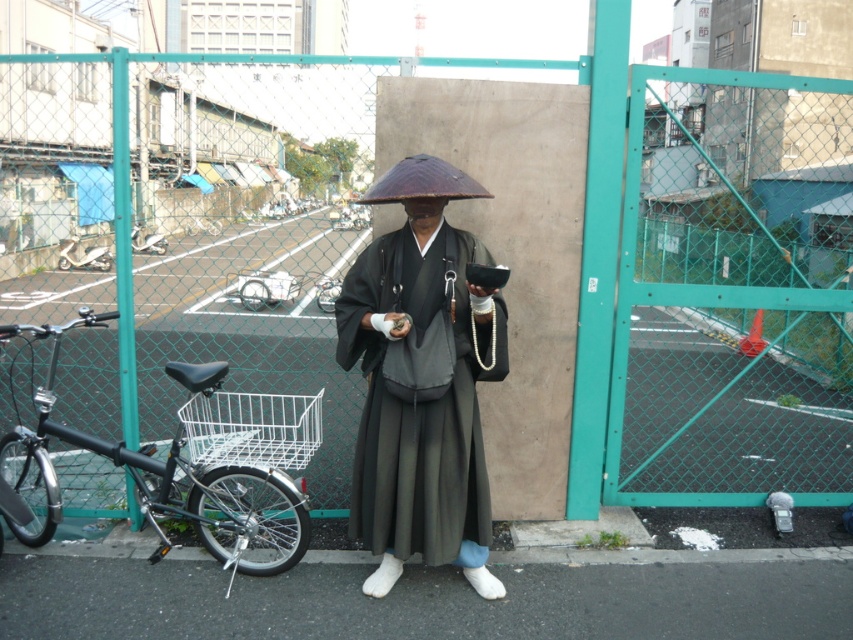
Question: Which object appears closest to the camera in this image?

Choices:
 (A) silver metallic bicycle at left
 (B) green chain-link fence at center
 (C) black matte bicycle at left

Answer: (B)

Question: Which object is the farthest from the silver metallic bicycle at left?

Choices:
 (A) black matte bicycle at left
 (B) shiny brown umbrella at center
 (C) black silk kimono at center

Answer: (B)

Question: Is green chain-link fence at center above shiny brown umbrella at center?

Choices:
 (A) no
 (B) yes

Answer: (B)

Question: Does green chain-link fence at center appear under black silk kimono at center?

Choices:
 (A) yes
 (B) no

Answer: (B)

Question: Is green chain-link fence at center to the left of silver metallic bicycle at left from the viewer's perspective?

Choices:
 (A) yes
 (B) no

Answer: (B)

Question: Among these objects, which one is farthest from the camera?

Choices:
 (A) black silk kimono at center
 (B) shiny brown umbrella at center
 (C) silver metallic bicycle at left
 (D) black matte bicycle at left

Answer: (C)